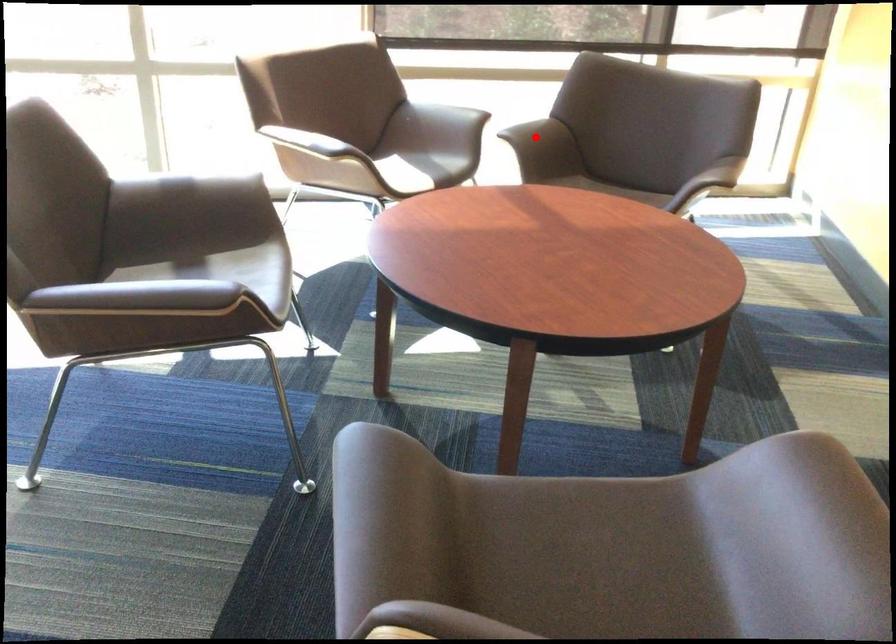
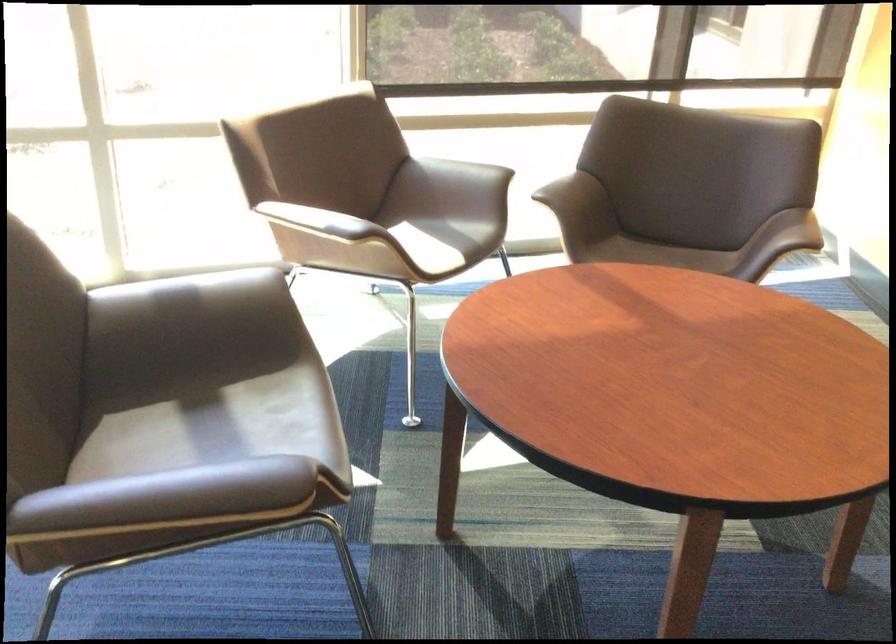
Question: A red point is marked in image1. In image2, is the corresponding 3D point closer to the camera or farther? Reply with the corresponding letter.

Choices:
 (A) The corresponding 3D point is closer.
 (B) The corresponding 3D point is farther.

Answer: (A)